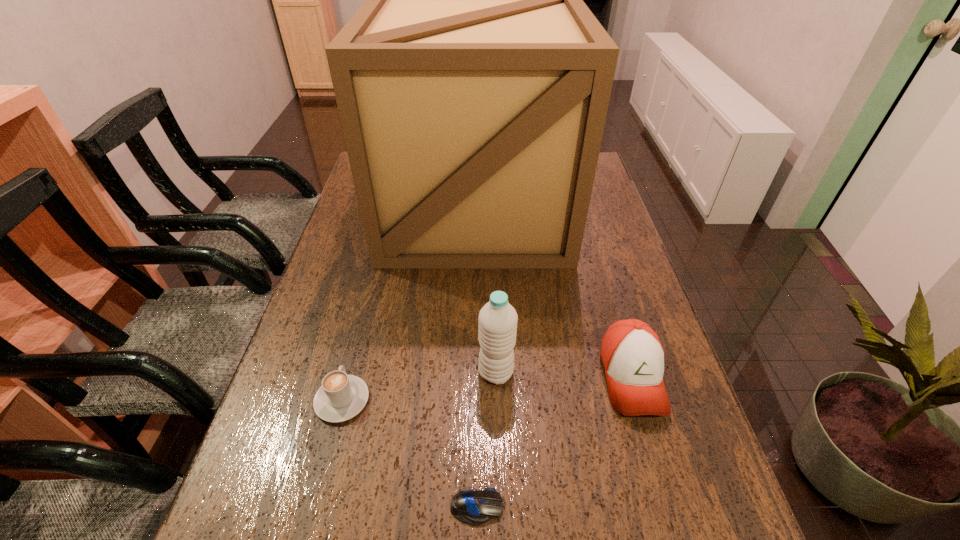
I want to click on vacant area that satisfies the following two spatial constraints: 1. to the right of the cappuccino; 2. on the right side of the water bottle, so pyautogui.click(x=349, y=373).